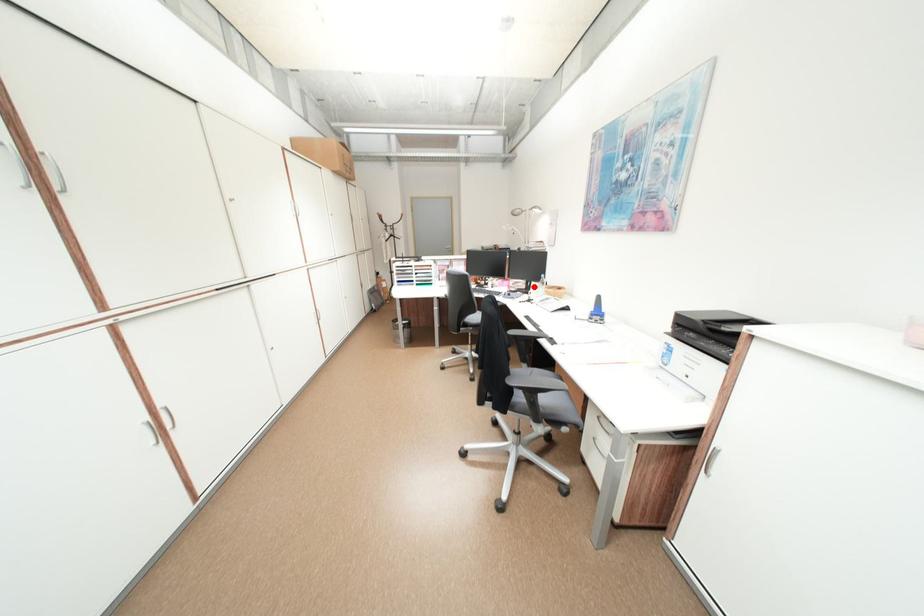
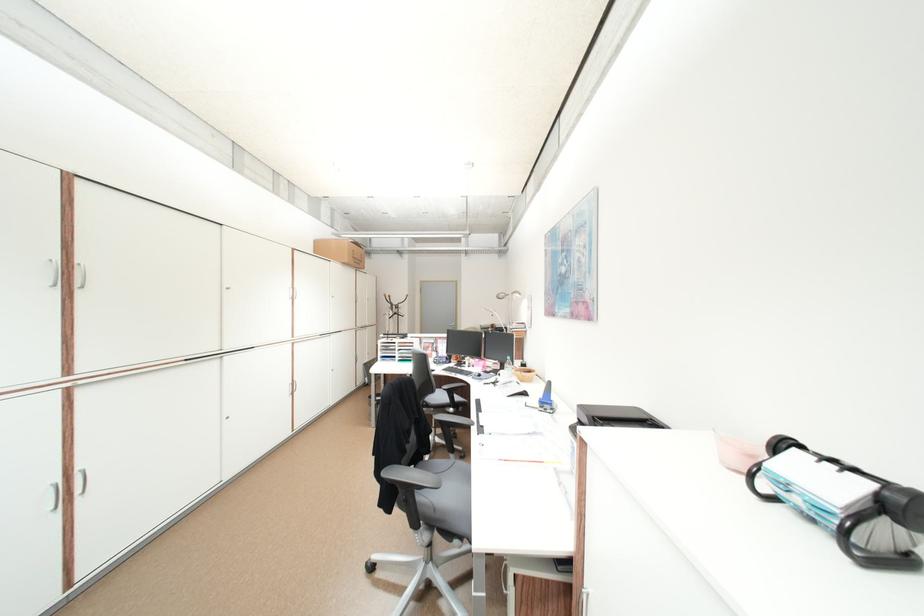
In the second image, find the point that corresponds to the highlighted location in the first image.

(507, 368)